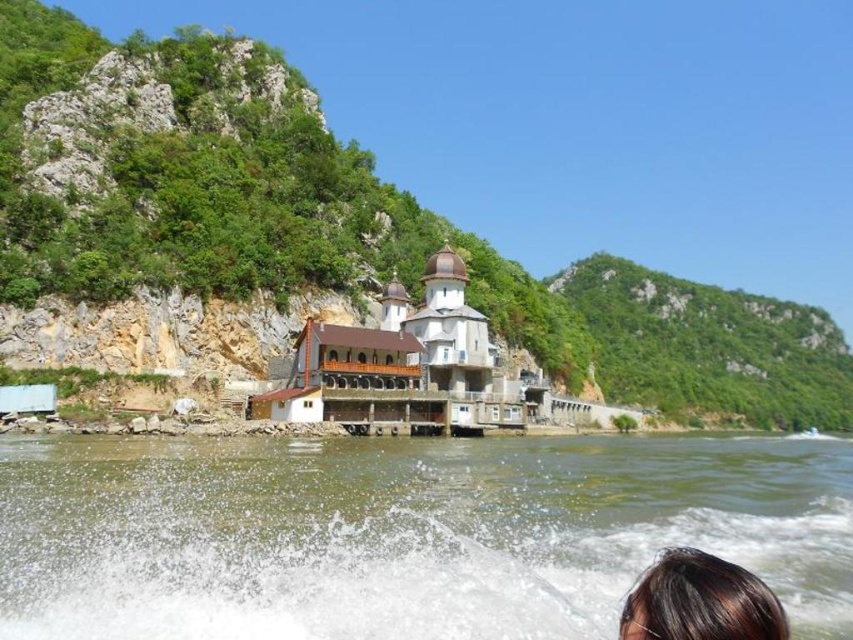
Question: Which point is closer to the camera?

Choices:
 (A) brown murky water at lower center
 (B) brown hair at lower right

Answer: (B)

Question: Does brown murky water at lower center appear on the right side of brown hair at lower right?

Choices:
 (A) no
 (B) yes

Answer: (B)

Question: Which point appears closest to the camera in this image?

Choices:
 (A) (360, 547)
 (B) (639, 584)

Answer: (B)

Question: Does brown murky water at lower center have a larger size compared to brown hair at lower right?

Choices:
 (A) yes
 (B) no

Answer: (A)

Question: Which object appears farthest from the camera in this image?

Choices:
 (A) brown hair at lower right
 (B) brown murky water at lower center

Answer: (B)

Question: Is brown murky water at lower center above brown hair at lower right?

Choices:
 (A) no
 (B) yes

Answer: (A)